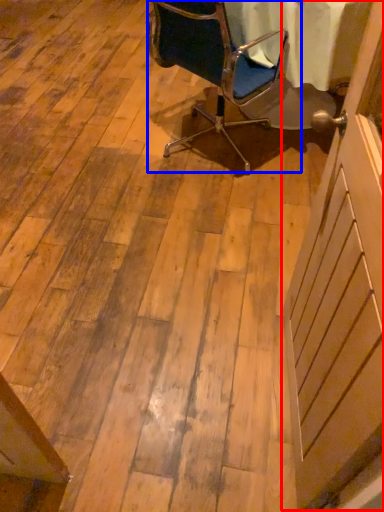
Question: Among these objects, which one is farthest to the camera, screen door (highlighted by a red box) or chair (highlighted by a blue box)?

Choices:
 (A) screen door
 (B) chair

Answer: (B)